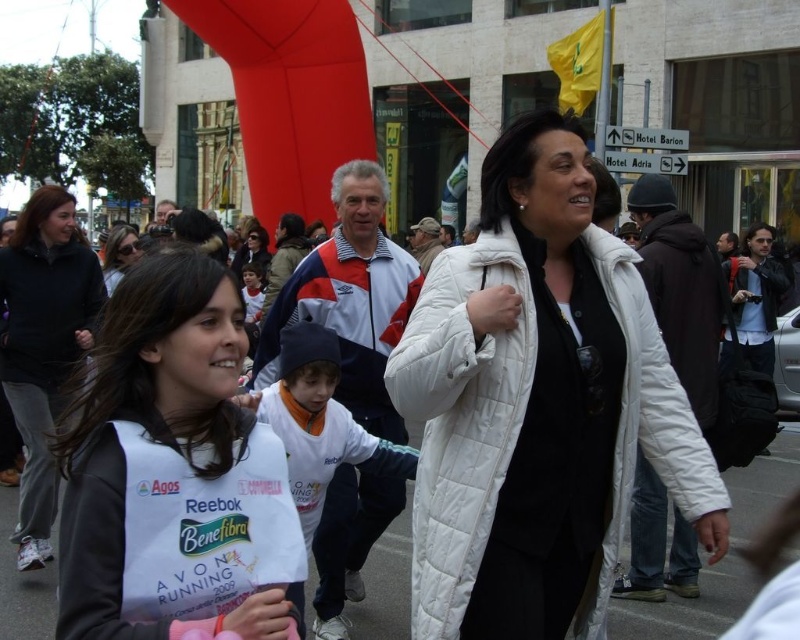
What is the color of the jacket worn by the person at the point with coordinates [537,404]?

The jacket at point [537,404] is white quilted jacket at center.

From the picture: You are a photographer at the event and want to capture both the matte white jacket at center and the white cotton shirt at center in a single shot. Which object should you focus on first to ensure both are in frame?

A: The matte white jacket at center is taller than the white cotton shirt at center, so focus on the taller object first to ensure both fit in the frame.

Looking at this image, you are a photographer trying to capture the scene. You need to focus on the matte white jacket at center and the white cotton shirt at center. Which one should you adjust your camera to focus on first if you want to capture both clearly in the same frame?

The matte white jacket at center is located above the white cotton shirt at center, so you should focus on the white cotton shirt at center first since it is closer to the camera and adjust the focus accordingly to ensure both are in the frame.